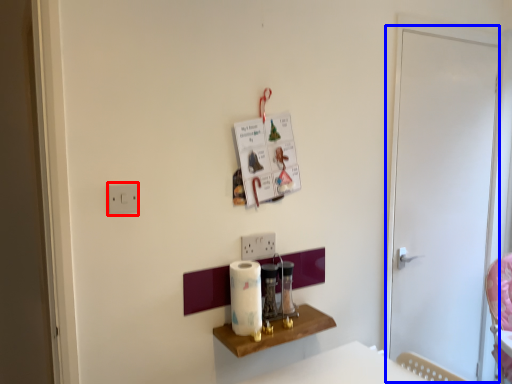
Question: Which point is closer to the camera, light switch (highlighted by a red box) or screen door (highlighted by a blue box)?

Choices:
 (A) light switch
 (B) screen door

Answer: (A)